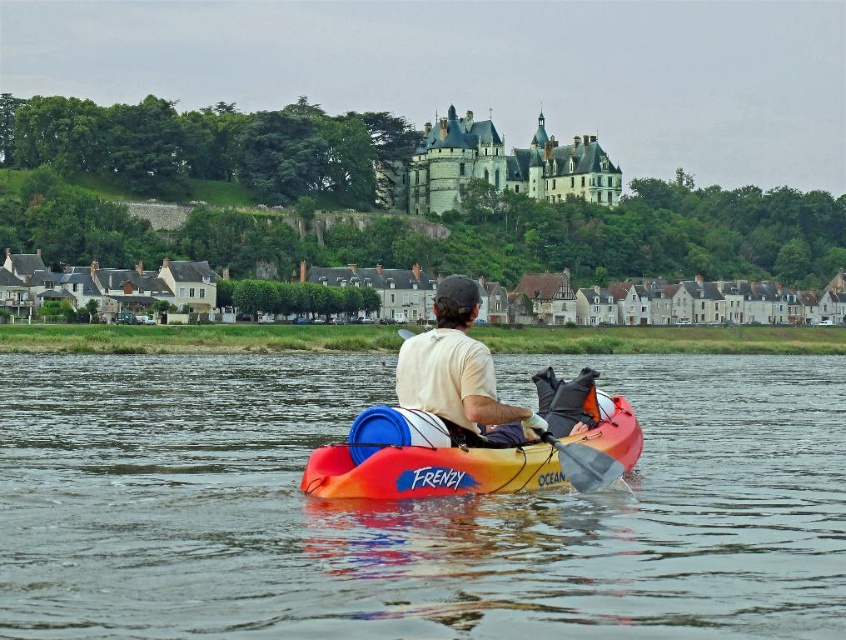
Describe the element at coordinates (411, 506) in the screenshot. I see `orange kayak at center` at that location.

Between orange kayak at center and stone gray castle at upper center, which one appears on the right side from the viewer's perspective?

Positioned to the right is stone gray castle at upper center.

Locate an element on the screen. The width and height of the screenshot is (846, 640). orange kayak at center is located at coordinates pyautogui.click(x=411, y=506).

Can you confirm if stone gray castle at upper center is bigger than white fabric shirt at center?

Yes, stone gray castle at upper center is bigger than white fabric shirt at center.

Is stone gray castle at upper center thinner than white fabric shirt at center?

Incorrect, stone gray castle at upper center's width is not less than white fabric shirt at center's.

Where is `stone gray castle at upper center`? stone gray castle at upper center is located at coordinates (492, 168).

Between orange kayak at center and orange/yellow plastic kayak at center, which one appears on the right side from the viewer's perspective?

Positioned to the right is orange/yellow plastic kayak at center.

Where is `orange kayak at center`? This screenshot has height=640, width=846. orange kayak at center is located at coordinates (411, 506).

At what (x,y) coordinates should I click in order to perform the action: click on orange kayak at center. Please return your answer as a coordinate pair (x, y). The image size is (846, 640). Looking at the image, I should click on (411, 506).

The width and height of the screenshot is (846, 640). What are the coordinates of `orange kayak at center` in the screenshot? It's located at (411, 506).